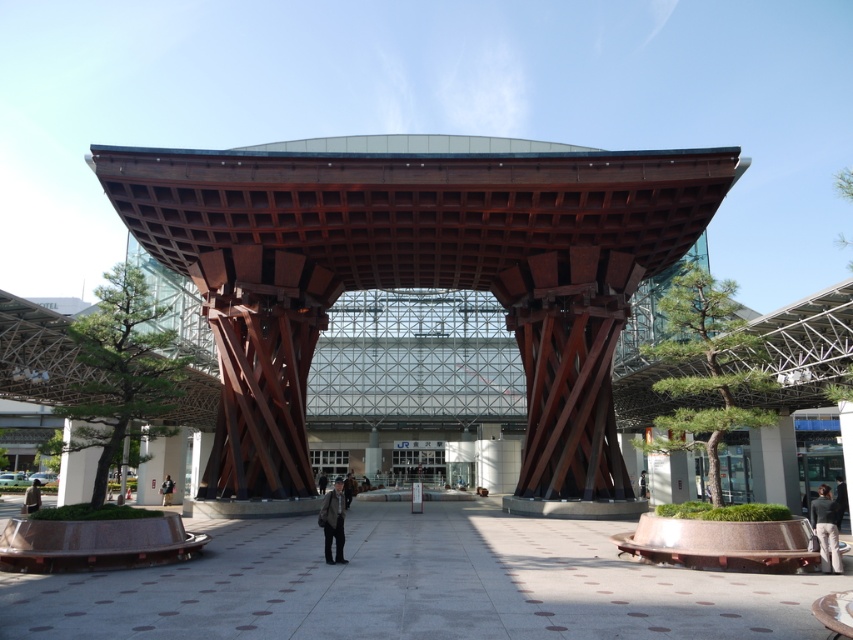
You are an architect analyzing the layout of this modern building. You notice the wooden structure at center and the dark brown leather jacket at center. Which object is placed higher in the image?

The wooden structure at center is positioned over the dark brown leather jacket at center, so it is placed higher in the image.

You are an observer standing in the middle of the pavilion. You notice two items on the ground near the angular metal beams. The items are the light beige pants at lower right and the light brown leather jacket at lower left. Which item has a smaller width?

The light beige pants at lower right is thinner than the light brown leather jacket at lower left, so the light beige pants at lower right has a smaller width.